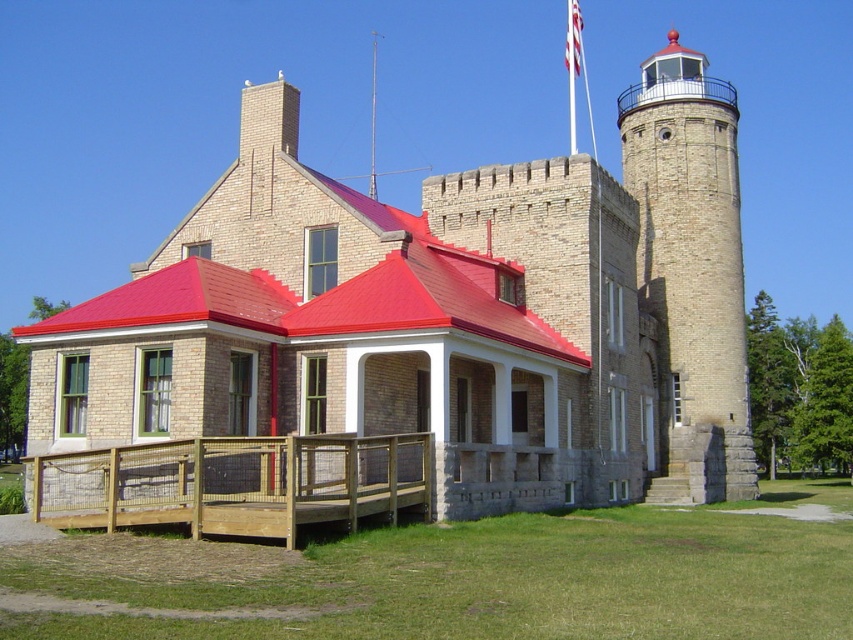
At what (x,y) coordinates should I click in order to perform the action: click on stone lighthouse at upper right. Please return your answer as a coordinate pair (x, y). Looking at the image, I should click on (691, 269).

Find the location of a particular element. stone lighthouse at upper right is located at coordinates (691, 269).

The height and width of the screenshot is (640, 853). What do you see at coordinates (444, 314) in the screenshot?
I see `brick stone castle at center` at bounding box center [444, 314].

Is brick stone castle at center positioned in front of stone lighthouse at upper right?

Yes, brick stone castle at center is in front of stone lighthouse at upper right.

Is point (86, 333) positioned in front of point (682, 96)?

Yes, it is in front of point (682, 96).

Locate an element on the screen. brick stone castle at center is located at coordinates (444, 314).

Is brick stone castle at center smaller than white fabric flag at upper center?

Actually, brick stone castle at center might be larger than white fabric flag at upper center.

Between point (548, 164) and point (567, 44), which one is positioned in front?

Positioned in front is point (548, 164).

Between point (312, 342) and point (570, 1), which one is positioned behind?

The point (570, 1) is behind.

Identify the location of brick stone castle at center. (444, 314).